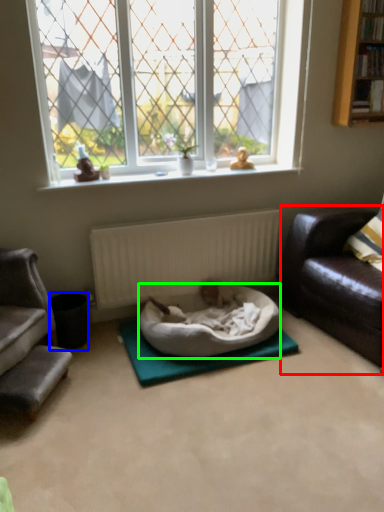
Question: Estimate the real-world distances between objects in this image. Which object is farther from studio couch (highlighted by a red box), trash bin/can (highlighted by a blue box) or dog bed (highlighted by a green box)?

Choices:
 (A) trash bin/can
 (B) dog bed

Answer: (A)